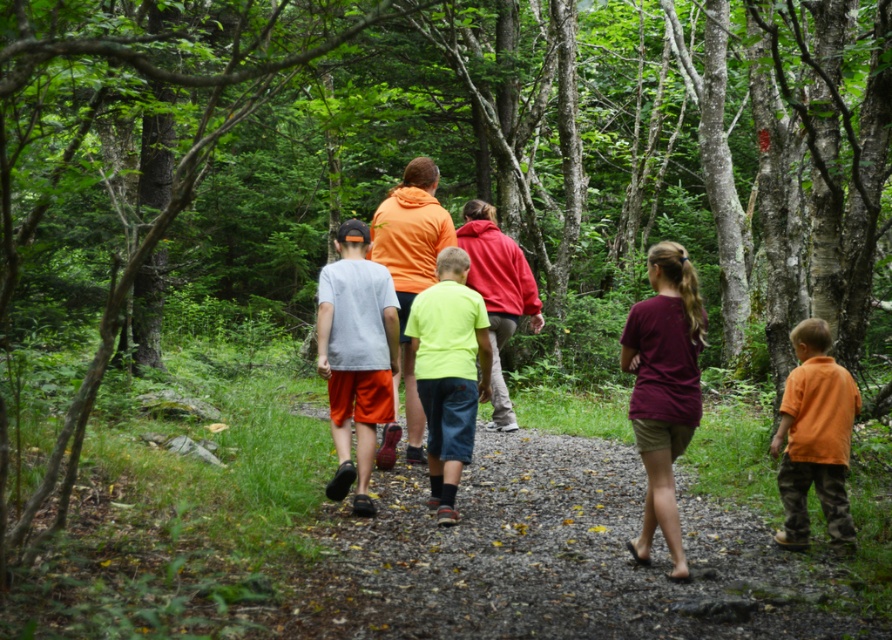
In the scene shown: Is orange cotton hoodie at center below gray matte t-shirt at center?

Correct, orange cotton hoodie at center is located below gray matte t-shirt at center.

Is orange cotton hoodie at center taller than gray matte t-shirt at center?

No, orange cotton hoodie at center is not taller than gray matte t-shirt at center.

Find the location of a particular element. Image resolution: width=892 pixels, height=640 pixels. orange cotton hoodie at center is located at coordinates (666, 388).

Describe the element at coordinates (354, 355) in the screenshot. I see `gray matte t-shirt at center` at that location.

Can you confirm if gray matte t-shirt at center is taller than orange cotton shirt at lower right?

Yes.

This screenshot has height=640, width=892. Describe the element at coordinates (354, 355) in the screenshot. I see `gray matte t-shirt at center` at that location.

Locate an element on the screen. gray matte t-shirt at center is located at coordinates (354, 355).

Which is in front, point (458, 403) or point (775, 476)?

Positioned in front is point (458, 403).

Which of these two, neon green fabric shorts at center or orange cotton shirt at lower right, stands taller?

Standing taller between the two is neon green fabric shorts at center.

Identify the location of neon green fabric shorts at center. (449, 372).

Image resolution: width=892 pixels, height=640 pixels. Find the location of `neon green fabric shorts at center`. neon green fabric shorts at center is located at coordinates (449, 372).